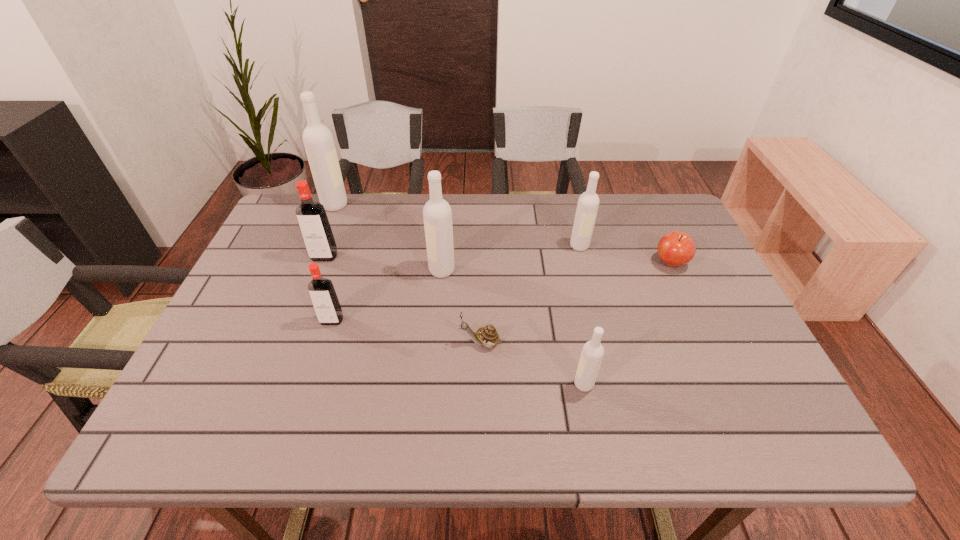
I want to click on the sixth object from right to left, so click(x=328, y=310).

I want to click on the nearer red vodka, so click(x=328, y=310).

You are a GUI agent. You are given a task and a screenshot of the screen. Output one action in this format:
    pyautogui.click(x=<x>, y=<y>)
    Task: Click on the rightmost object
    The height and width of the screenshot is (540, 960).
    Given the screenshot: What is the action you would take?
    pyautogui.click(x=675, y=248)

Locate an element on the screen. the fourth object from right to left is located at coordinates (487, 336).

This screenshot has width=960, height=540. What are the coordinates of `gray snail` in the screenshot? It's located at (487, 336).

You are a GUI agent. You are given a task and a screenshot of the screen. Output one action in this format:
    pyautogui.click(x=<x>, y=<y>)
    Task: Click on the free space located on the front of the biggest white vodka
    The width and height of the screenshot is (960, 540).
    Given the screenshot: What is the action you would take?
    pyautogui.click(x=306, y=276)

The image size is (960, 540). Identify the location of free point located 0.120m on the left of the second tallest object. (385, 270).

You are a GUI agent. You are given a task and a screenshot of the screen. Output one action in this format:
    pyautogui.click(x=<x>, y=<y>)
    Task: Click on the vacant region located on the right of the second farthest white vodka
    Image resolution: width=960 pixels, height=540 pixels.
    Given the screenshot: What is the action you would take?
    pyautogui.click(x=648, y=246)

Locate an element on the screen. The width and height of the screenshot is (960, 540). free space located on the front and back of the bigger red vodka is located at coordinates (299, 324).

I want to click on vacant space located 0.130m on the right of the fifth vodka from left to right, so click(x=655, y=384).